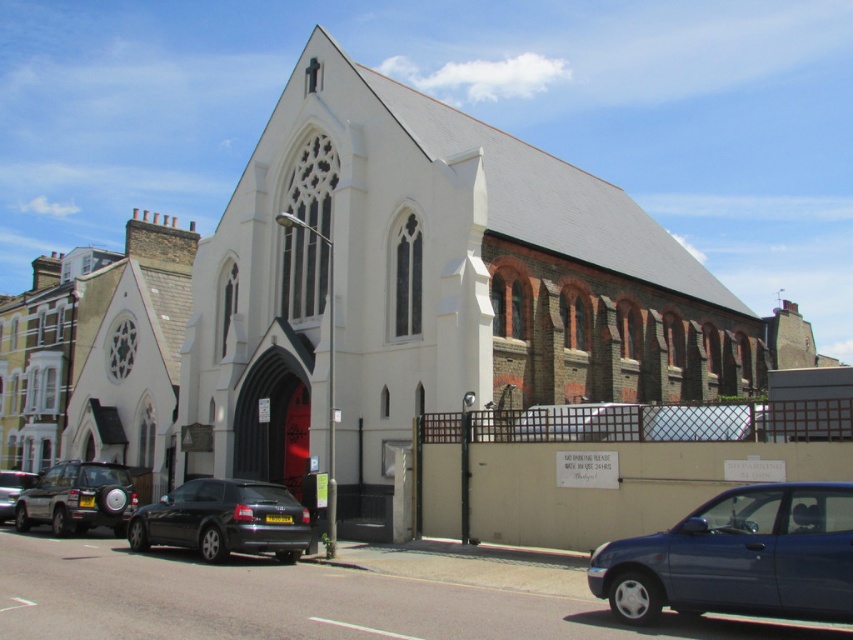
Question: Which of the following is the farthest from the observer?

Choices:
 (A) glossy black car at lower left
 (B) metallic blue sedan at lower right
 (C) matte black car at lower left

Answer: (C)

Question: Estimate the real-world distances between objects in this image. Which object is closer to the white stone chapel at center?

Choices:
 (A) silver metallic suv at left
 (B) metallic blue sedan at lower right

Answer: (A)

Question: Which object is positioned closest to the metallic blue sedan at lower right?

Choices:
 (A) glossy black car at lower left
 (B) matte black car at lower left
 (C) white stone chapel at center

Answer: (A)

Question: Is metallic blue sedan at lower right further to the viewer compared to silver metallic suv at left?

Choices:
 (A) yes
 (B) no

Answer: (B)

Question: Is white stone chapel at center in front of silver metallic suv at left?

Choices:
 (A) no
 (B) yes

Answer: (A)

Question: Can you confirm if metallic blue sedan at lower right is thinner than matte black car at lower left?

Choices:
 (A) no
 (B) yes

Answer: (B)